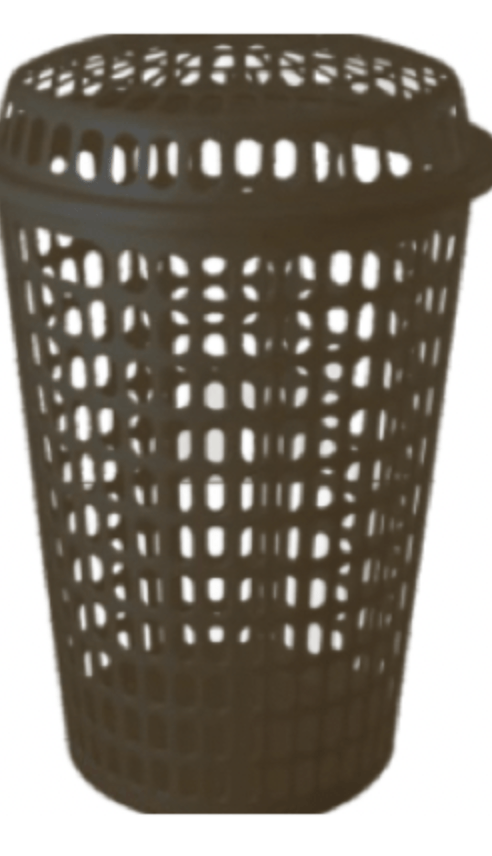
I want to click on base of basket that is solid, so click(212, 779).